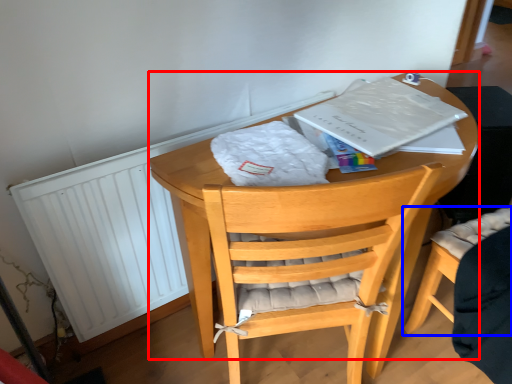
Question: Which point is further to the camera, round table (highlighted by a red box) or chair (highlighted by a blue box)?

Choices:
 (A) round table
 (B) chair

Answer: (B)